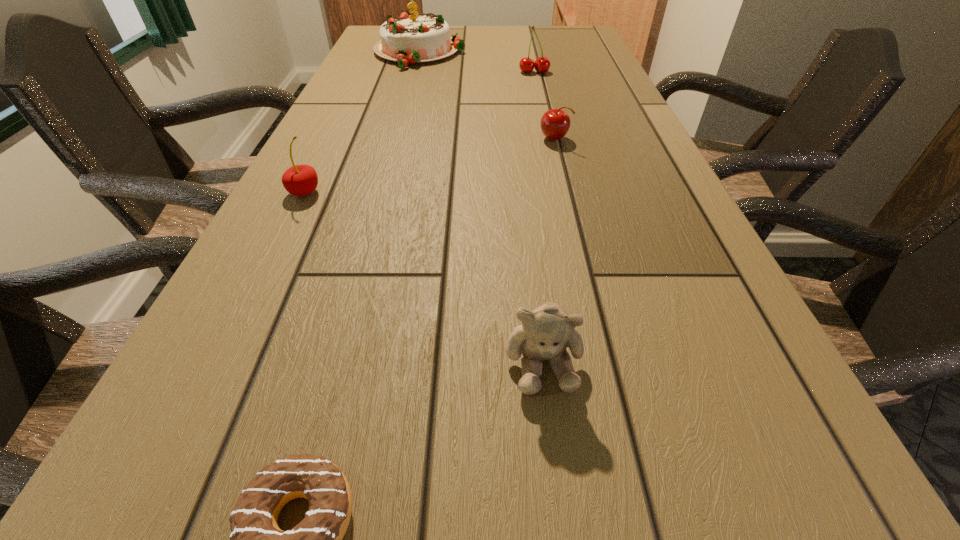
Locate an element on the screen. The image size is (960, 540). vacant space located 0.090m on the face of the teddy bear is located at coordinates (x=557, y=479).

The image size is (960, 540). In order to click on vacant space located on the back of the fifth tallest object in this screenshot , I will do `click(544, 102)`.

You are a GUI agent. You are given a task and a screenshot of the screen. Output one action in this format:
    pyautogui.click(x=<x>, y=<y>)
    Task: Click on the object that is at the far edge
    Image resolution: width=960 pixels, height=540 pixels.
    Given the screenshot: What is the action you would take?
    pyautogui.click(x=409, y=39)

The image size is (960, 540). I want to click on cake present at the left edge, so tap(409, 39).

You are a GUI agent. You are given a task and a screenshot of the screen. Output one action in this format:
    pyautogui.click(x=<x>, y=<y>)
    Task: Click on the cherry present at the left edge
    Image resolution: width=960 pixels, height=540 pixels.
    Given the screenshot: What is the action you would take?
    pyautogui.click(x=299, y=180)

The image size is (960, 540). Identify the location of object situated at the far left corner. (409, 39).

This screenshot has width=960, height=540. I want to click on blank space at the far edge of the desktop, so click(488, 25).

Locate an element on the screen. The height and width of the screenshot is (540, 960). free space at the left edge is located at coordinates (357, 158).

In the image, there is a desktop. In order to click on vacant space at the right edge in this screenshot , I will do `click(680, 192)`.

Where is `vacant space at the far right corner`? vacant space at the far right corner is located at coordinates (594, 41).